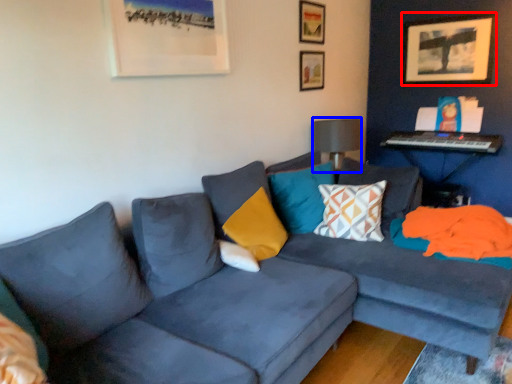
Question: Which of the following is the farthest to the observer, picture frame (highlighted by a red box) or lamp (highlighted by a blue box)?

Choices:
 (A) picture frame
 (B) lamp

Answer: (A)